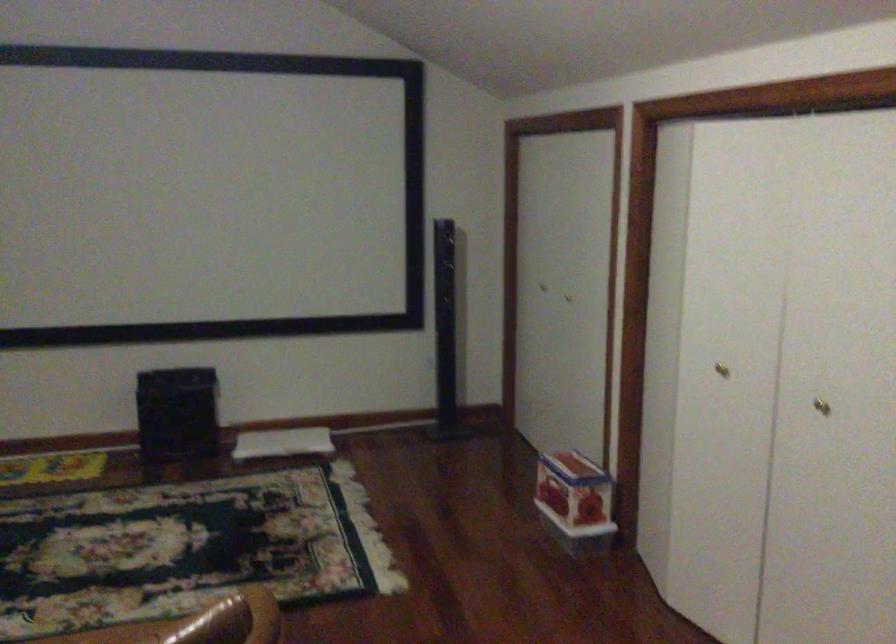
Find the location of a particular element. The image size is (896, 644). black subwoofer is located at coordinates (177, 413).